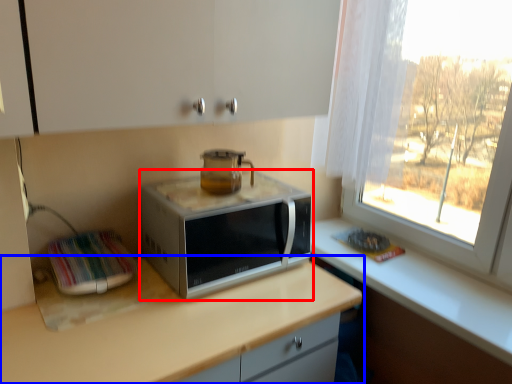
Question: Among these objects, which one is nearest to the camera, microwave oven (highlighted by a red box) or countertop (highlighted by a blue box)?

Choices:
 (A) microwave oven
 (B) countertop

Answer: (B)